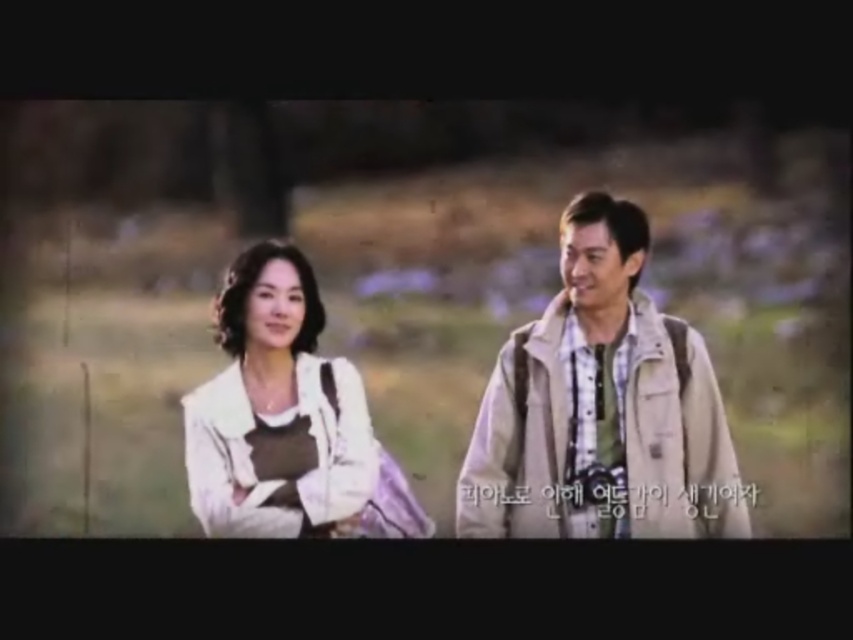
Can you confirm if beige canvas jacket at center is thinner than white fabric jacket at left?

In fact, beige canvas jacket at center might be wider than white fabric jacket at left.

Can you confirm if beige canvas jacket at center is positioned to the left of white fabric jacket at left?

No, beige canvas jacket at center is not to the left of white fabric jacket at left.

Is point (641, 397) less distant than point (262, 275)?

No, it is not.

Identify the location of beige canvas jacket at center. This screenshot has height=640, width=853. (601, 408).